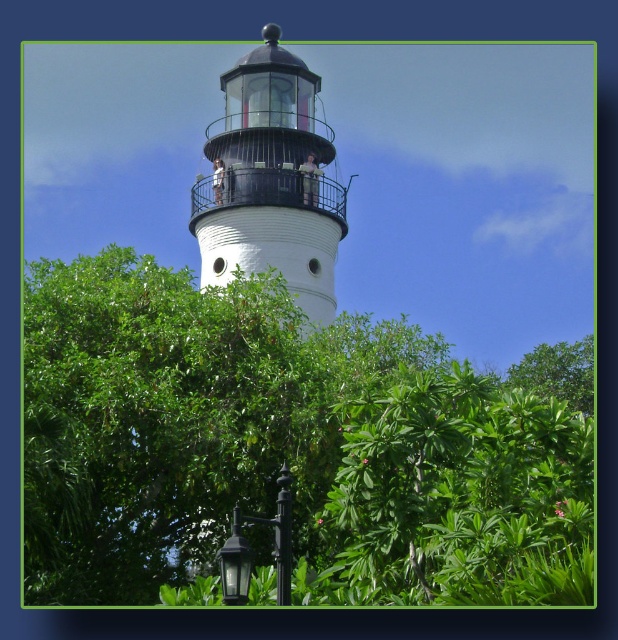
Question: Is green leafy tree at center to the left of black metal/texture lamp post at lower center from the viewer's perspective?

Choices:
 (A) no
 (B) yes

Answer: (A)

Question: Which point is farther to the camera?

Choices:
 (A) green leafy tree at center
 (B) white matte/lightweight tower at center

Answer: (B)

Question: Which point is farther from the camera taking this photo?

Choices:
 (A) (255, 212)
 (B) (193, 538)

Answer: (A)

Question: Is green leafy tree at center positioned at the back of white matte/lightweight tower at center?

Choices:
 (A) no
 (B) yes

Answer: (A)

Question: Which point is closer to the camera?

Choices:
 (A) green leafy tree at center
 (B) white matte/lightweight tower at center

Answer: (A)

Question: In this image, where is green leafy tree at center located relative to black metal/texture lamp post at lower center?

Choices:
 (A) right
 (B) left

Answer: (A)